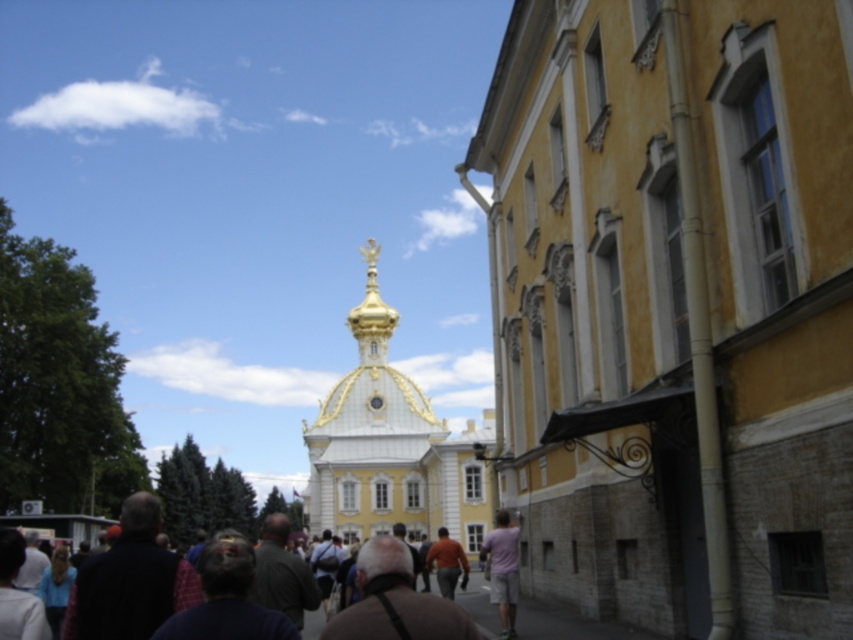
You are standing on the bustling street scene in front of the yellow building with classical architectural features. You see two points marked on the ground in front of you. One is at point [646,253] and the other is at point [368,337]. Which point is closer to you?

Point [646,253] is closer to the viewer than point [368,337].

You are standing in the historic city street scene. You see two points marked as point 1 at coordinate (329, 522) and point 2 at coordinate (492, 541). Which point is closer to your current position?

Point 1 at coordinate (329, 522) is closer to your current position because it is further to the camera than point 2 at coordinate (492, 541).